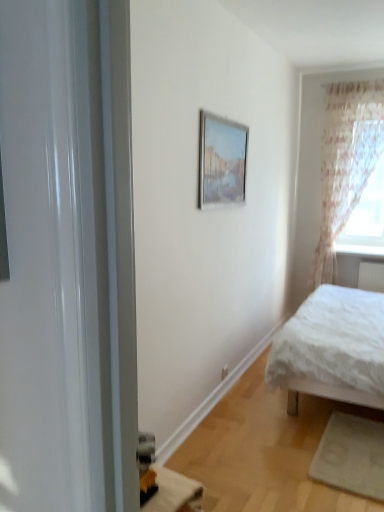
Question: Is sheer floral fabric at right inside the boundaries of matte silver picture frame at upper center, or outside?

Choices:
 (A) outside
 (B) inside

Answer: (A)

Question: Is sheer floral fabric at right bigger or smaller than matte silver picture frame at upper center?

Choices:
 (A) big
 (B) small

Answer: (A)

Question: Which is farther from the matte silver picture frame at upper center?

Choices:
 (A) sheer floral fabric at right
 (B) white glossy window sill at upper right
 (C) translucent floral curtain at right
 (D) white textured bed at right

Answer: (B)

Question: Based on their relative distances, which object is nearer to the translucent floral curtain at right?

Choices:
 (A) sheer floral fabric at right
 (B) matte silver picture frame at upper center
 (C) white textured bed at right
 (D) white glossy window sill at upper right

Answer: (A)